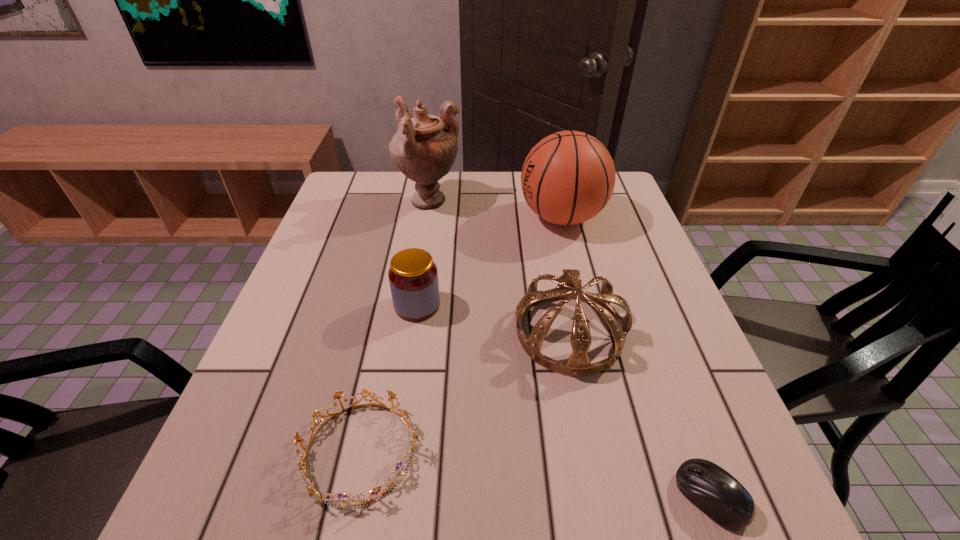
The image size is (960, 540). Find the location of `object at the left edge`. object at the left edge is located at coordinates (413, 435).

Identify the location of basketball that is at the right edge. (567, 178).

Locate an element on the screen. The height and width of the screenshot is (540, 960). tiara that is at the right edge is located at coordinates (569, 286).

Where is `mouse located at the right edge`? The width and height of the screenshot is (960, 540). mouse located at the right edge is located at coordinates (713, 490).

Image resolution: width=960 pixels, height=540 pixels. I want to click on object located in the near left corner section of the desktop, so click(x=413, y=435).

This screenshot has height=540, width=960. Identify the location of object at the far right corner. (567, 178).

Locate an element on the screen. object at the near right corner is located at coordinates (713, 490).

I want to click on vacant space at the far edge of the desktop, so click(503, 194).

In the image, there is a desktop. Identify the location of free region at the near edge. (576, 489).

This screenshot has height=540, width=960. In the image, there is a desktop. In order to click on free region at the left edge in this screenshot , I will do `click(308, 426)`.